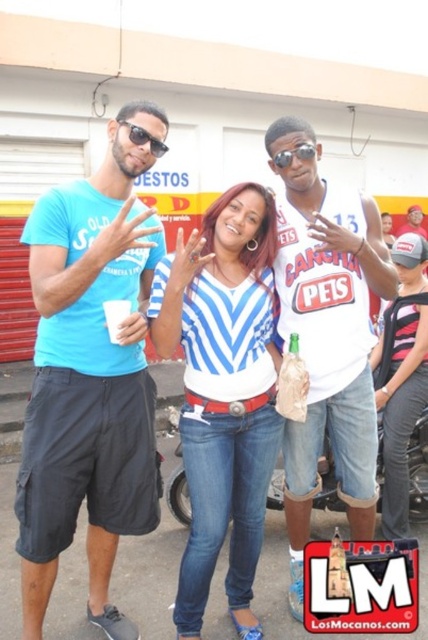
You are standing at a distance of 10 feet from the scene. You want to take a photo of the point at coordinates point (281, 424). Can you reach it with your camera lens that has a maximum focal length of 100mm? Assume the camera sensor size is 35mm and the required magnification is 1x.

The distance of point (281, 424) from viewer is 8.06 feet, so yes, the camera lens with a maximum focal length of 100mm can reach the point at coordinates point (281, 424) because the distance is within the lens capability.